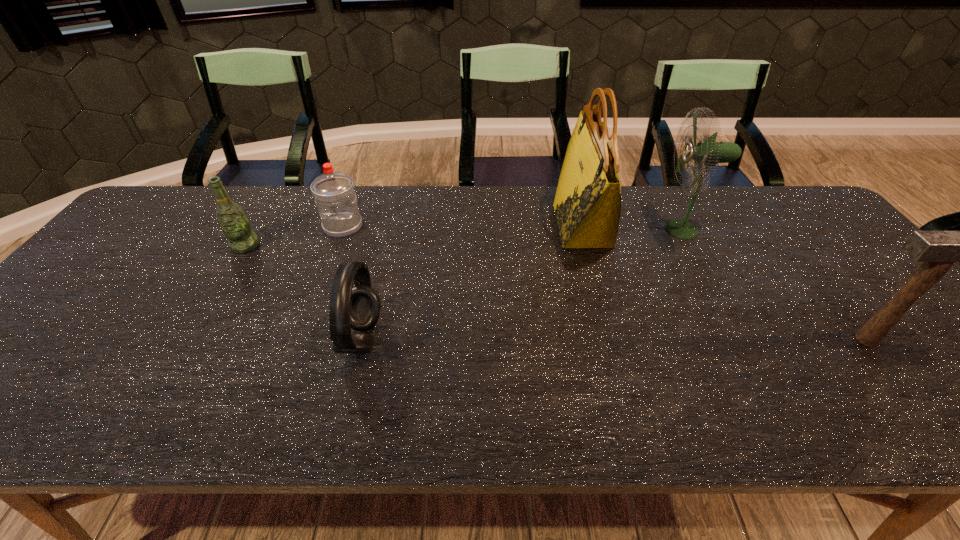
You are a GUI agent. You are given a task and a screenshot of the screen. Output one action in this format:
    pyautogui.click(x=<x>, y=<y>)
    Task: Click on the vacant region located on the front-facing side of the second object from right to left
    
    Given the screenshot: What is the action you would take?
    pyautogui.click(x=633, y=230)

The image size is (960, 540). In order to click on vacant space located 0.080m on the front-facing side of the second object from right to left in this screenshot , I will do `click(633, 230)`.

Find the location of a particular element. The height and width of the screenshot is (540, 960). vacant space located 0.400m on the front-facing side of the second object from right to left is located at coordinates (524, 230).

Image resolution: width=960 pixels, height=540 pixels. Identify the location of free region located on the left of the rightmost object. (733, 340).

In order to click on vacant region located 0.050m on the surface of the leftmost object in this screenshot , I will do pos(233,267).

Image resolution: width=960 pixels, height=540 pixels. Find the location of `vacant region located on the handle side of the fifth object from right to left`. vacant region located on the handle side of the fifth object from right to left is located at coordinates (332, 257).

The image size is (960, 540). Identify the location of free location located 0.170m on the earcups of the third object from left to right. (454, 339).

Find the location of a particular element. The image size is (960, 540). tote bag that is at the far edge is located at coordinates (587, 204).

What are the coordinates of `fan that is at the far edge` in the screenshot? It's located at (708, 152).

The image size is (960, 540). Identify the location of water bottle located at the far edge. (334, 194).